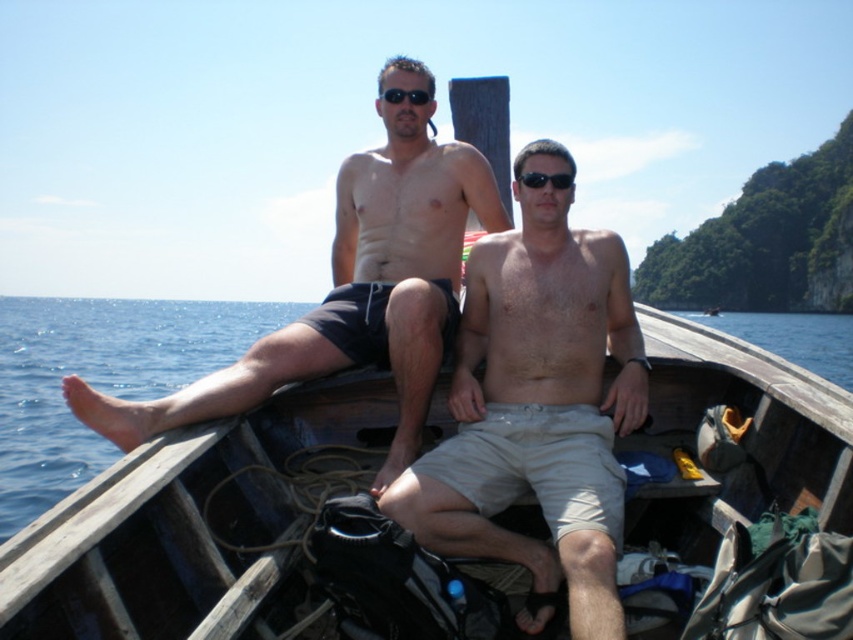
Question: Is matte black shorts at upper center smaller than black matte sunglasses at center?

Choices:
 (A) no
 (B) yes

Answer: (A)

Question: Does light beige shorts at center appear on the left side of matte black shorts at upper center?

Choices:
 (A) no
 (B) yes

Answer: (A)

Question: Which of these objects is positioned farthest from the matte black shorts at upper center?

Choices:
 (A) wooden boat at center
 (B) black plastic sunglasses at center
 (C) light beige shorts at center

Answer: (A)

Question: Which point is farther from the camera taking this photo?

Choices:
 (A) click(555, 188)
 (B) click(381, 161)
 (C) click(117, 600)
 (D) click(473, 394)

Answer: (B)

Question: Is matte black shorts at upper center wider than black plastic sunglasses at center?

Choices:
 (A) no
 (B) yes

Answer: (B)

Question: Which object appears closest to the camera in this image?

Choices:
 (A) wooden boat at center
 (B) black matte sunglasses at center
 (C) black plastic sunglasses at center

Answer: (A)